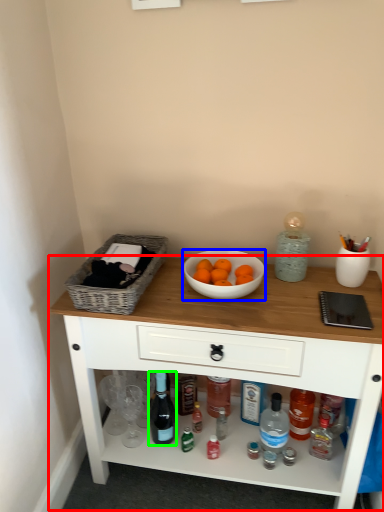
Question: Based on their relative distances, which object is nearer to table (highlighted by a red box)? Choose from bowl (highlighted by a blue box) and bottle (highlighted by a green box).

Choices:
 (A) bowl
 (B) bottle

Answer: (A)